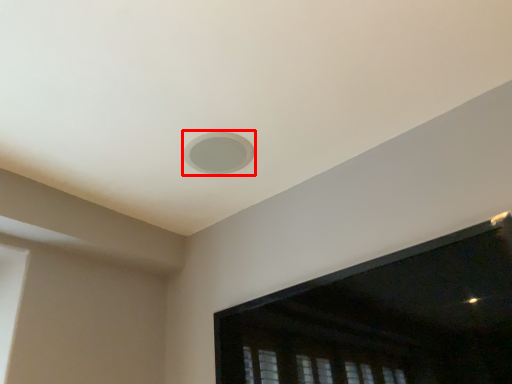
Question: Observing the image, what is the correct spatial positioning of hole (annotated by the red box) in reference to window screen?

Choices:
 (A) left
 (B) right

Answer: (A)